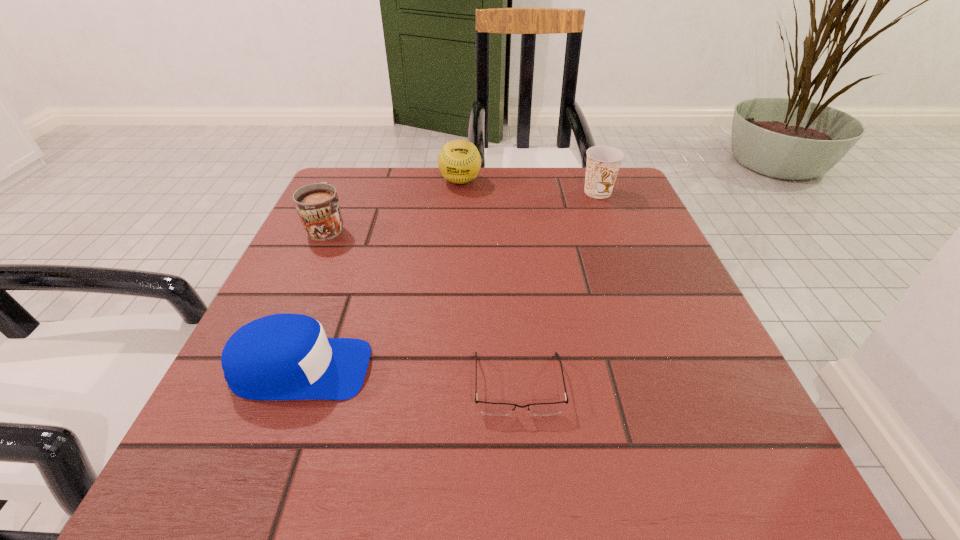
Locate an element on the screen. softball is located at coordinates (459, 161).

Identify the location of Dixie cup. (603, 162).

Identify the location of mug. The height and width of the screenshot is (540, 960). (317, 205).

Identify the location of baseball cap. The image size is (960, 540). (286, 356).

At what (x,y) coordinates should I click in order to perform the action: click on the shortest object. Please return your answer as a coordinate pair (x, y). Image resolution: width=960 pixels, height=540 pixels. Looking at the image, I should click on (495, 409).

The width and height of the screenshot is (960, 540). I want to click on vacant space situated on the logo side of the softball, so click(x=453, y=281).

Find the location of a particular element. The image size is (960, 540). vacant area situated on the front of the Dixie cup is located at coordinates (607, 215).

Locate an element on the screen. free space located 0.130m on the side of the mug with the handle is located at coordinates (347, 183).

Find the location of a particular element. The height and width of the screenshot is (540, 960). vacant space positioned on the side of the mug with the handle is located at coordinates (345, 187).

At what (x,y) coordinates should I click in order to perform the action: click on free space located on the side of the mug with the handle. Please return your answer as a coordinate pair (x, y). Looking at the image, I should click on (344, 191).